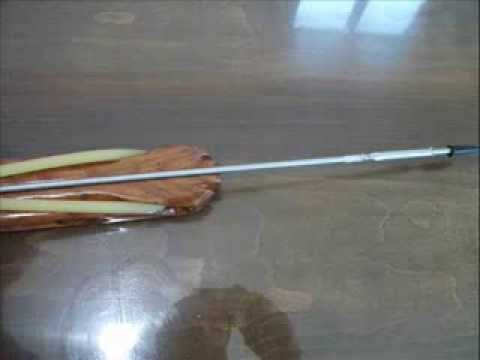
What are the coordinates of `reflection of blue rectangular windows` in the screenshot? It's located at (329, 7), (385, 11).